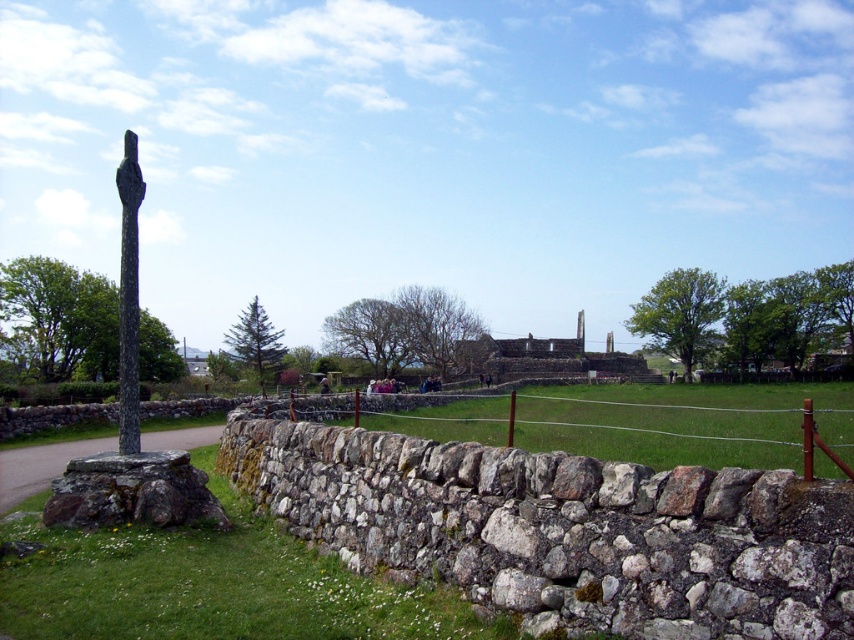
Question: Does natural stone wall at center appear under green grass at lower left?

Choices:
 (A) no
 (B) yes

Answer: (A)

Question: Considering the real-world distances, which object is closest to the green grass at lower left?

Choices:
 (A) dark gray stone pole at left
 (B) natural stone wall at center

Answer: (B)

Question: Estimate the real-world distances between objects in this image. Which object is closer to the natural stone wall at center?

Choices:
 (A) dark gray stone pole at left
 (B) green grass at lower left

Answer: (B)

Question: Which of the following is the farthest from the observer?

Choices:
 (A) green grass at lower left
 (B) dark gray stone pole at left

Answer: (B)

Question: Does natural stone wall at center appear on the left side of green grass at lower left?

Choices:
 (A) yes
 (B) no

Answer: (B)

Question: Is green grass at lower left to the right of dark gray stone pole at left from the viewer's perspective?

Choices:
 (A) no
 (B) yes

Answer: (B)